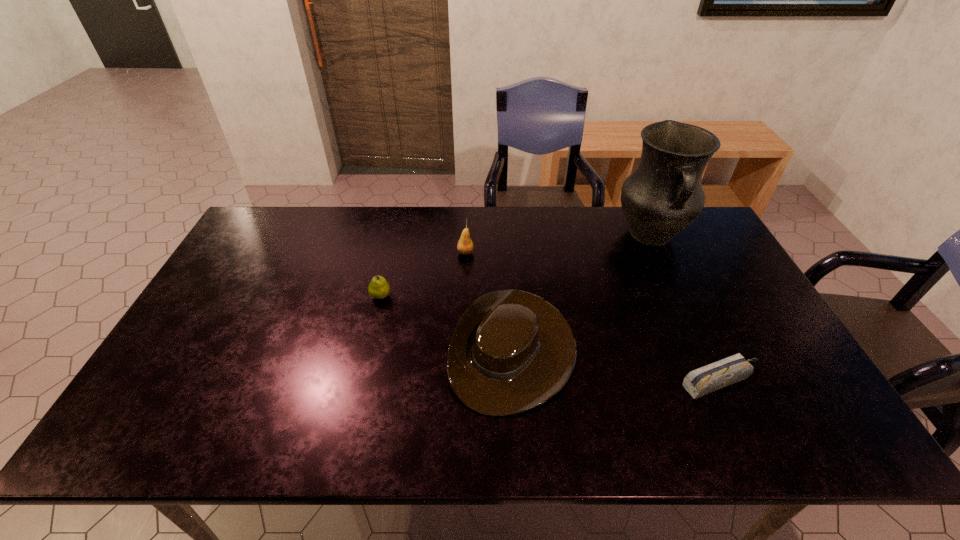
Where is `free space located 0.280m on the left of the cowboy hat`? free space located 0.280m on the left of the cowboy hat is located at coordinates (343, 350).

This screenshot has height=540, width=960. What are the coordinates of `free spot located on the left of the shortest object` in the screenshot? It's located at (529, 382).

Locate an element on the screen. pitcher that is at the far edge is located at coordinates (663, 196).

This screenshot has height=540, width=960. Find the location of `pear present at the far edge`. pear present at the far edge is located at coordinates (465, 246).

You are a GUI agent. You are given a task and a screenshot of the screen. Output one action in this format:
    pyautogui.click(x=<x>, y=<y>)
    Task: Click on the object that is positioned at the near edge
    This screenshot has height=540, width=960.
    Given the screenshot: What is the action you would take?
    pyautogui.click(x=511, y=351)

The width and height of the screenshot is (960, 540). I want to click on pitcher that is at the right edge, so click(x=663, y=196).

Locate an element on the screen. Image resolution: width=960 pixels, height=540 pixels. pencil box that is at the right edge is located at coordinates (702, 381).

Locate an element on the screen. The height and width of the screenshot is (540, 960). object present at the far right corner is located at coordinates (663, 196).

Locate an element on the screen. Image resolution: width=960 pixels, height=540 pixels. free region at the far edge of the desktop is located at coordinates (386, 235).

Identify the location of free space at the near edge. (228, 444).